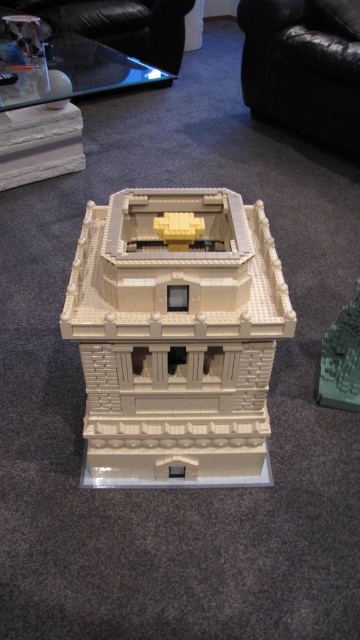
Question: Which point is farther to the camera?

Choices:
 (A) (342, 374)
 (B) (272, 308)

Answer: (A)

Question: Which point is farther to the camera?

Choices:
 (A) click(x=358, y=332)
 (B) click(x=187, y=365)

Answer: (A)

Question: Does beige lego tower at center lie in front of green matte brick at right?

Choices:
 (A) yes
 (B) no

Answer: (A)

Question: Among these points, which one is nearest to the camera?

Choices:
 (A) (336, 371)
 (B) (92, 362)

Answer: (B)

Question: In this image, where is beige lego tower at center located relative to green matte brick at right?

Choices:
 (A) right
 (B) left

Answer: (B)

Question: Is beige lego tower at center positioned behind green matte brick at right?

Choices:
 (A) no
 (B) yes

Answer: (A)